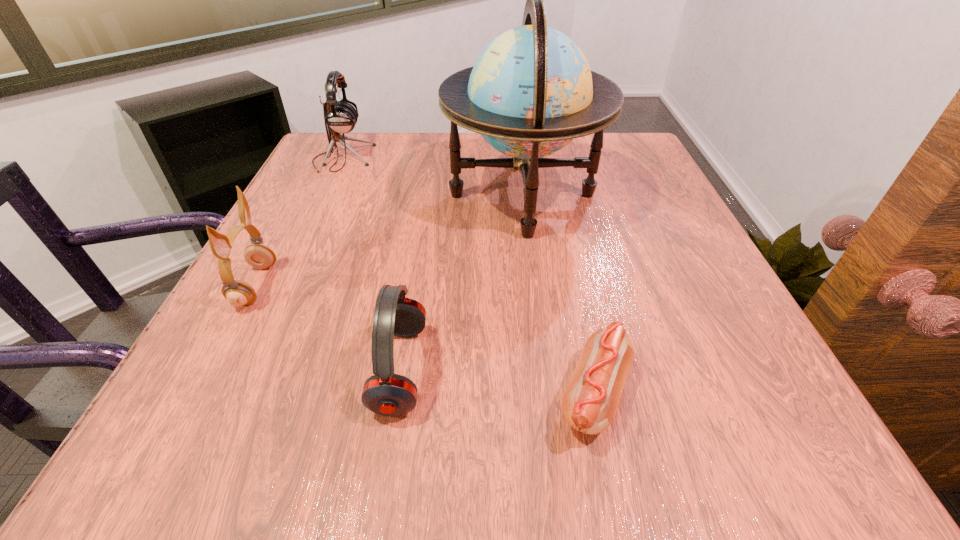
Where is `object that stands as the closest to the tallest earphone`? object that stands as the closest to the tallest earphone is located at coordinates (531, 91).

The height and width of the screenshot is (540, 960). Find the location of `the third closest earphone relative to the shortest object`. the third closest earphone relative to the shortest object is located at coordinates (340, 116).

Select which earphone appears as the closest to the shortest earphone. Please provide its 2D coordinates. Your answer should be formatted as a tuple, i.e. [(x, y)], where the tuple contains the x and y coordinates of a point satisfying the conditions above.

[(238, 293)]

Locate an element on the screen. The width and height of the screenshot is (960, 540). free space that satisfies the following two spatial constraints: 1. on the surface of the shortest object; 2. on the left side of the globe is located at coordinates (547, 395).

Locate an element on the screen. The width and height of the screenshot is (960, 540). vacant space that satisfies the following two spatial constraints: 1. on the back side of the shortest object; 2. on the front-facing side of the third shortest object is located at coordinates (571, 285).

Identify the location of vacant space that satisfies the following two spatial constraints: 1. on the back side of the shortest object; 2. on the ear cups of the rightmost earphone. (589, 369).

Locate an element on the screen. blank area in the image that satisfies the following two spatial constraints: 1. on the front side of the second tallest object; 2. on the front-facing side of the third nearest object is located at coordinates (283, 285).